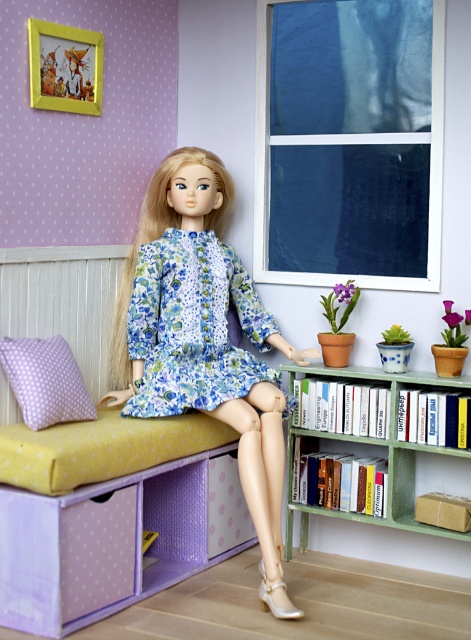
Question: Which point is closer to the camera?

Choices:
 (A) floral fabric dress at center
 (B) matte floral dress at center

Answer: (B)

Question: Which point is farther from the camera taking this photo?

Choices:
 (A) (266, 388)
 (B) (460, 476)

Answer: (B)

Question: Does matte floral dress at center have a greater width compared to floral fabric dress at center?

Choices:
 (A) yes
 (B) no

Answer: (A)

Question: Which of the following is the closest to the observer?

Choices:
 (A) (225, 262)
 (B) (376, 372)

Answer: (B)

Question: Considering the relative positions of matte floral dress at center and green matte bookcase at lower right in the image provided, where is matte floral dress at center located with respect to green matte bookcase at lower right?

Choices:
 (A) above
 (B) below

Answer: (A)

Question: Is matte floral dress at center below green matte bookcase at lower right?

Choices:
 (A) yes
 (B) no

Answer: (B)